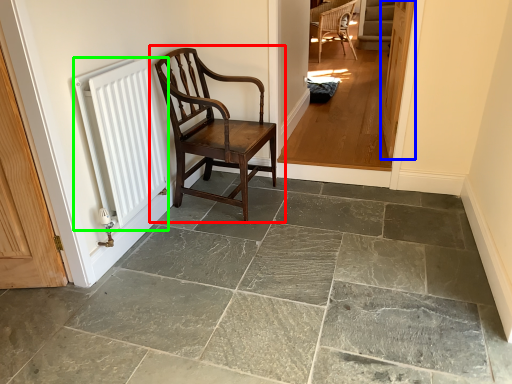
Question: Based on their relative distances, which object is nearer to chair (highlighted by a red box)? Choose from door (highlighted by a blue box) and radiator (highlighted by a green box).

Choices:
 (A) door
 (B) radiator

Answer: (B)